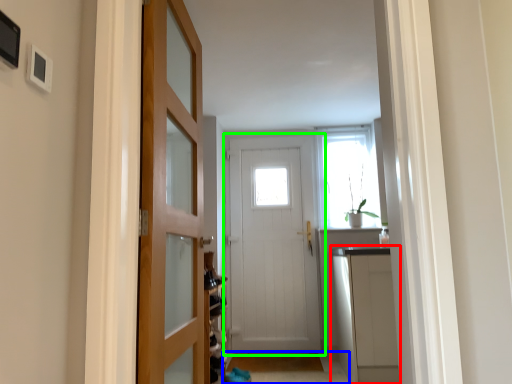
Question: Based on their relative distances, which object is farther from cabinetry (highlighted by a red box)? Choose from path (highlighted by a blue box) and door (highlighted by a green box).

Choices:
 (A) path
 (B) door

Answer: (B)